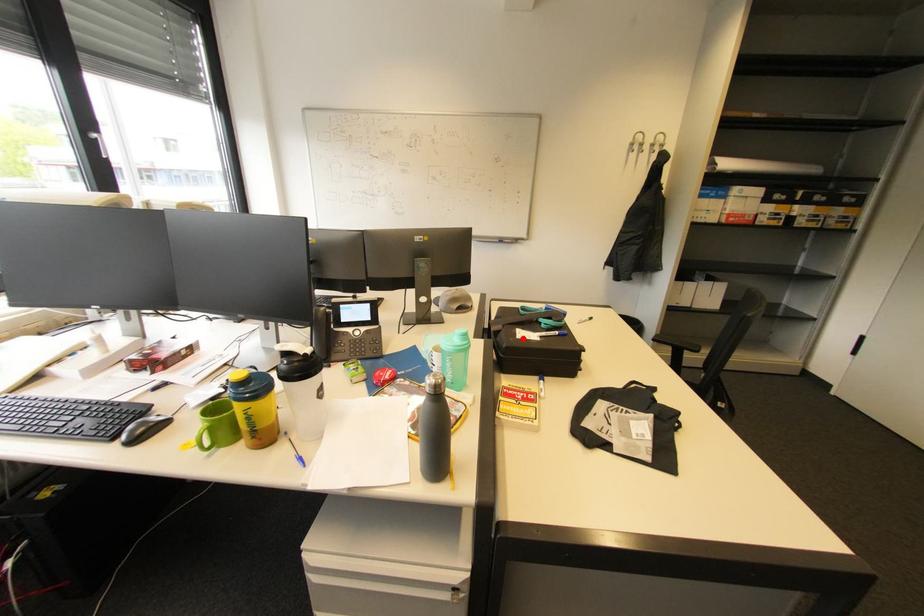
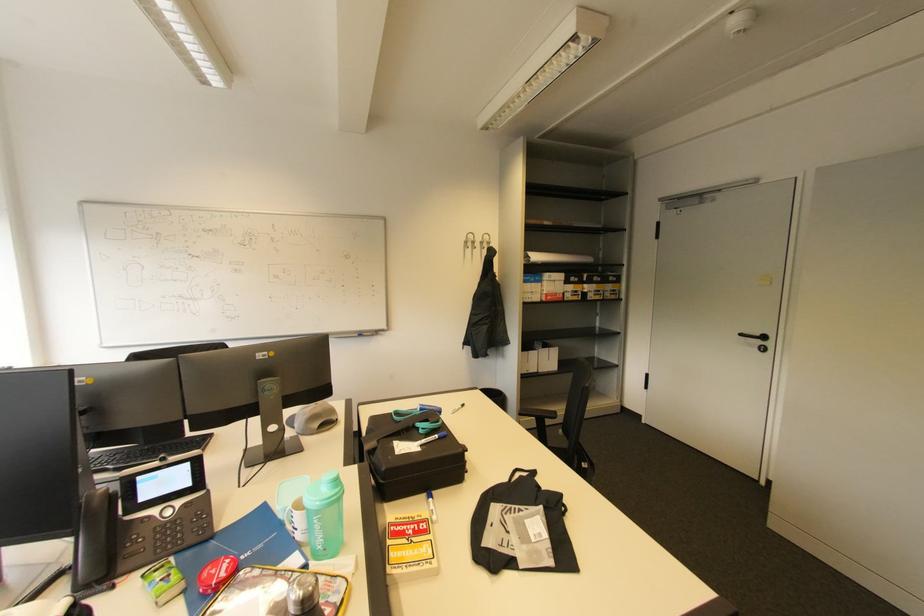
Question: I am providing you with two images of the same scene from different viewpoints. A red point is marked on the first image. Is the red point's position out of view in image 2?

Choices:
 (A) Yes
 (B) No

Answer: (B)